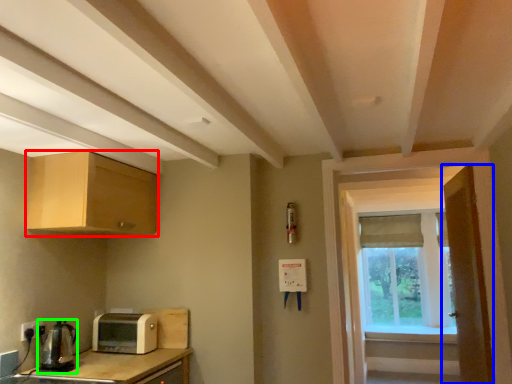
Question: Estimate the real-world distances between objects in this image. Which object is farther from cabinetry (highlighted by a red box), door (highlighted by a blue box) or coffee machine (highlighted by a green box)?

Choices:
 (A) door
 (B) coffee machine

Answer: (A)